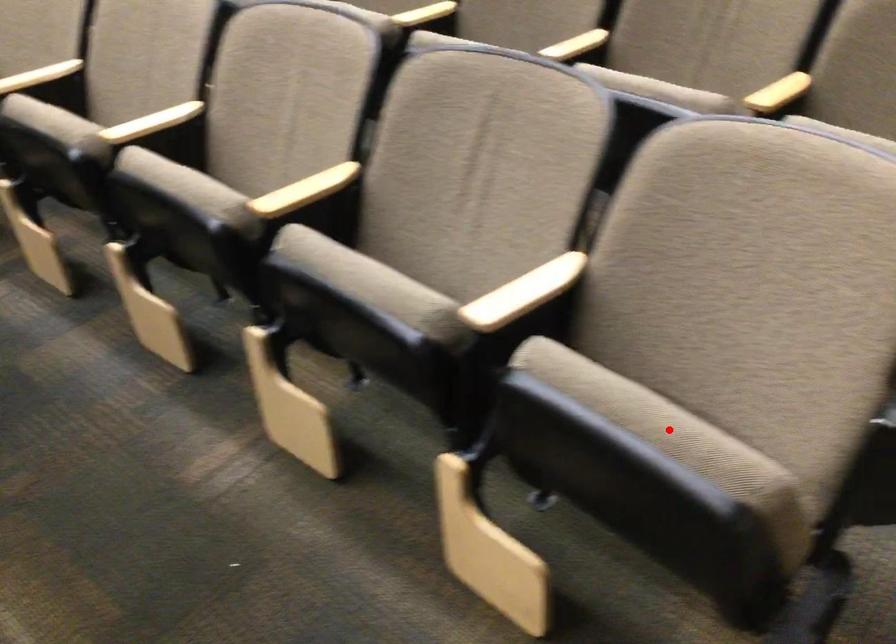
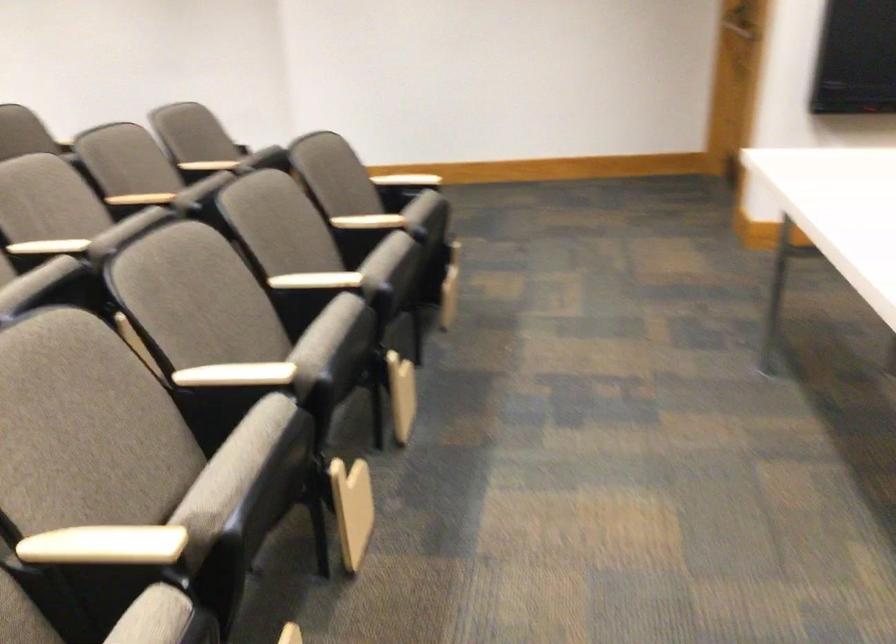
Question: I am providing you with two images of the same scene from different viewpoints. A red point is marked on the first image. Is the red point's position out of view in image 2?

Choices:
 (A) Yes
 (B) No

Answer: (A)